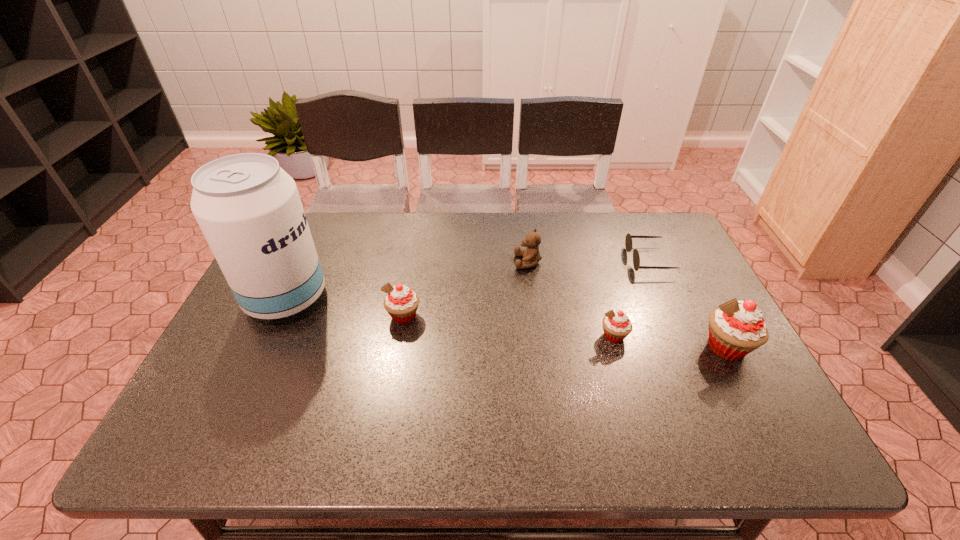
You are a GUI agent. You are given a task and a screenshot of the screen. Output one action in this format:
    pyautogui.click(x=<x>, y=<y>)
    Task: Click on the leftmost cupcake
    The height and width of the screenshot is (540, 960).
    Given the screenshot: What is the action you would take?
    pyautogui.click(x=401, y=303)

Find the location of a particular element. the second shortest cupcake is located at coordinates (401, 303).

Where is `the shortest cupcake`? Image resolution: width=960 pixels, height=540 pixels. the shortest cupcake is located at coordinates (617, 326).

I want to click on the second cupcake from left to right, so click(x=617, y=326).

Locate an element on the screen. This screenshot has height=540, width=960. the rightmost cupcake is located at coordinates (736, 328).

I want to click on the second tallest object, so click(x=736, y=328).

Image resolution: width=960 pixels, height=540 pixels. I want to click on sunglasses, so click(x=628, y=241).

You are a GUI agent. You are given a task and a screenshot of the screen. Output one action in this format:
    pyautogui.click(x=<x>, y=<y>)
    Task: Click on the teddy bear
    
    Given the screenshot: What is the action you would take?
    pyautogui.click(x=531, y=256)

At what (x,y) coordinates should I click in order to perform the action: click on the leftmost object. Please return your answer as a coordinate pair (x, y). The height and width of the screenshot is (540, 960). Looking at the image, I should click on (248, 208).

Where is `the tallest object`? Image resolution: width=960 pixels, height=540 pixels. the tallest object is located at coordinates (248, 208).